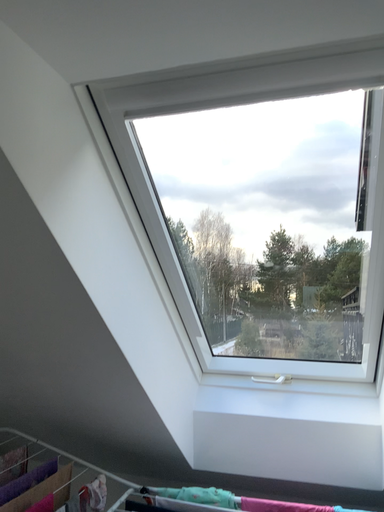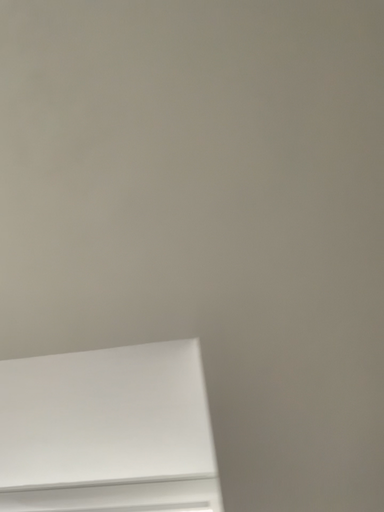
Question: How did the camera likely rotate when shooting the video?

Choices:
 (A) rotated left
 (B) rotated right

Answer: (B)